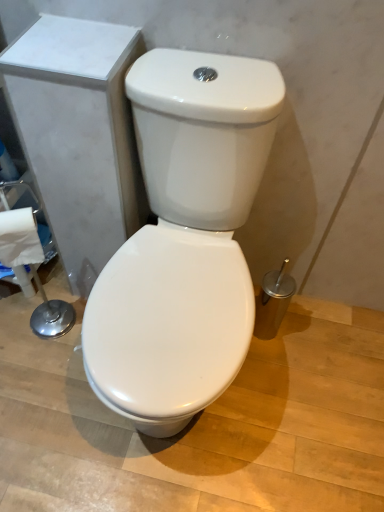
Identify the location of free point to the right of white glossy toilet at center. This screenshot has width=384, height=512. 304,391.